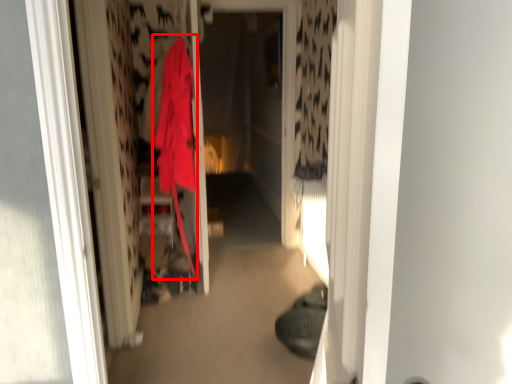
Question: In this image, where is cloak (annotated by the red box) located relative to screen door?

Choices:
 (A) left
 (B) right

Answer: (A)